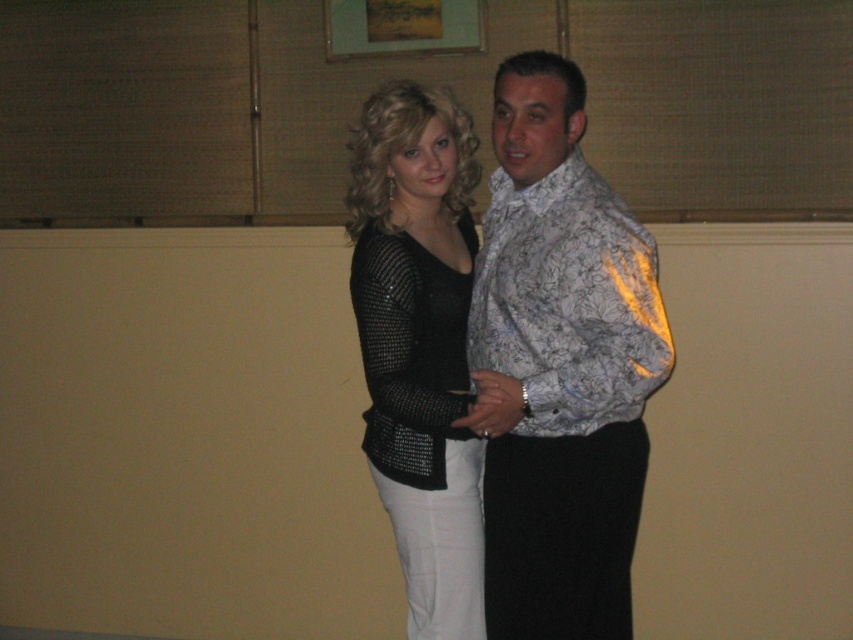
Who is positioned more to the left, shiny silver shirt at center or black sequined dress at center?

Positioned to the left is black sequined dress at center.

In the scene shown: Is shiny silver shirt at center to the right of black sequined dress at center from the viewer's perspective?

Answer: Correct, you'll find shiny silver shirt at center to the right of black sequined dress at center.

Where is `shiny silver shirt at center`? This screenshot has height=640, width=853. shiny silver shirt at center is located at coordinates click(x=560, y=365).

Locate an element on the screen. This screenshot has width=853, height=640. shiny silver shirt at center is located at coordinates (x=560, y=365).

Does shiny silver shirt at center appear under black sequined top at center?

Actually, shiny silver shirt at center is above black sequined top at center.

The width and height of the screenshot is (853, 640). What do you see at coordinates (560, 365) in the screenshot?
I see `shiny silver shirt at center` at bounding box center [560, 365].

Where is `shiny silver shirt at center`? The image size is (853, 640). shiny silver shirt at center is located at coordinates (560, 365).

Is black sequined top at center positioned at the back of black sequined dress at center?

Yes, black sequined top at center is behind black sequined dress at center.

Which is in front, point (387, 97) or point (358, 266)?

Positioned in front is point (358, 266).

The width and height of the screenshot is (853, 640). I want to click on black sequined top at center, so click(x=419, y=344).